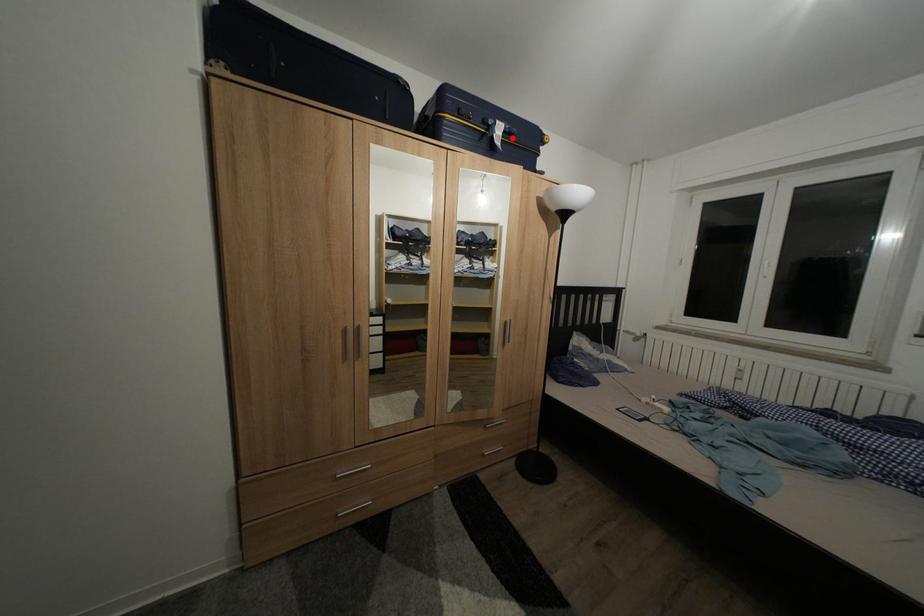
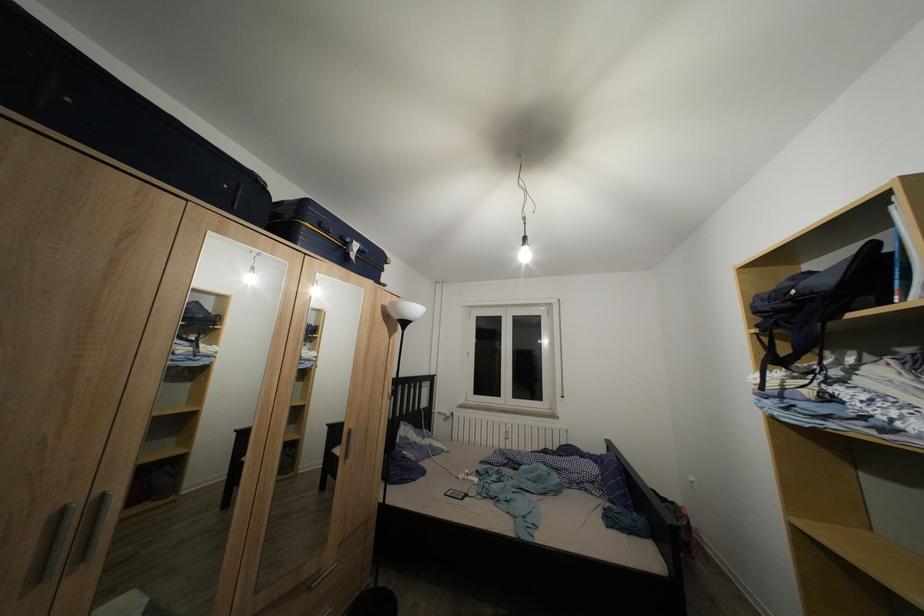
Question: I am providing you with two images of the same scene from different viewpoints. A red point is shown in image1. For the corresponding object point in image2, is it positioned nearer or farther from the camera?

Choices:
 (A) Nearer
 (B) Farther

Answer: (B)